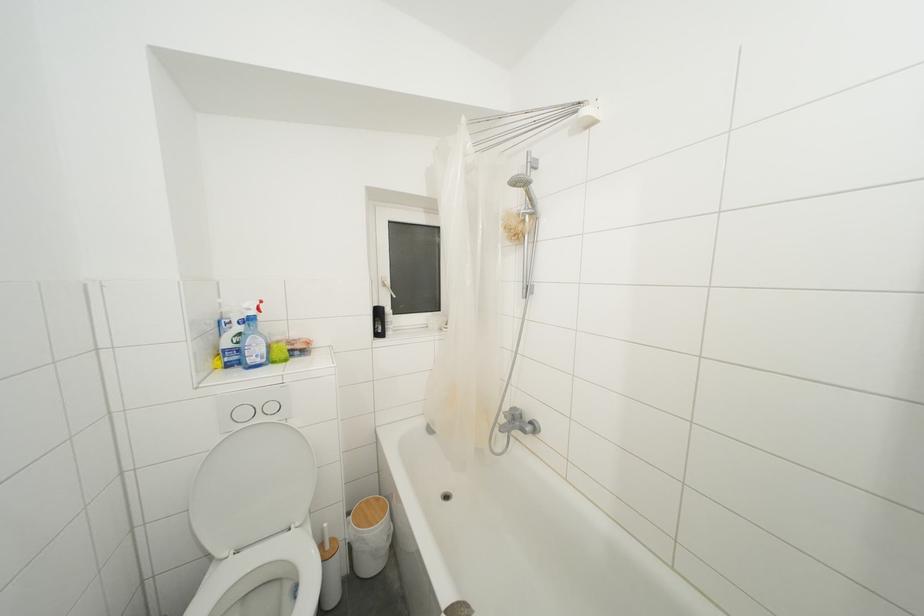
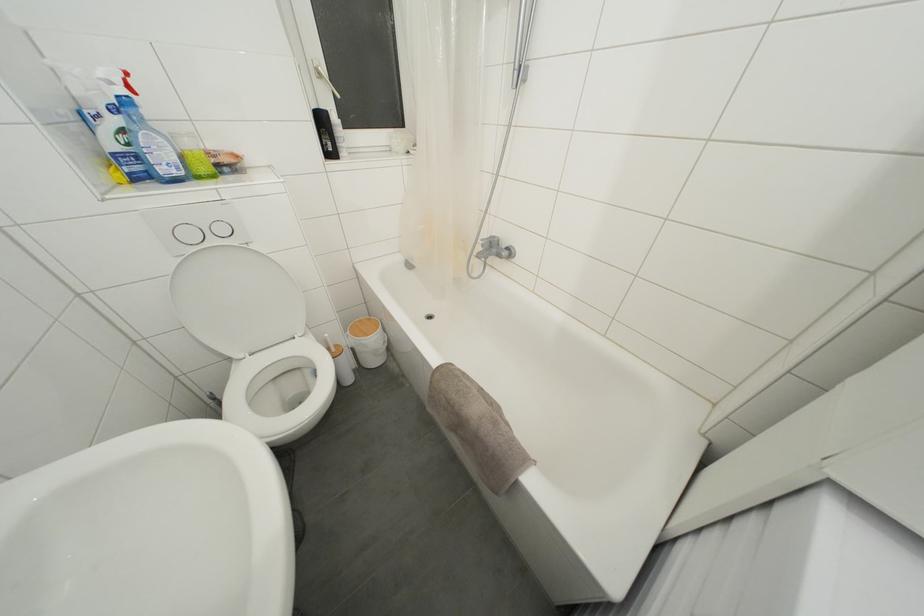
The point at (371,506) is marked in the first image. Where is the corresponding point in the second image?

(363, 326)